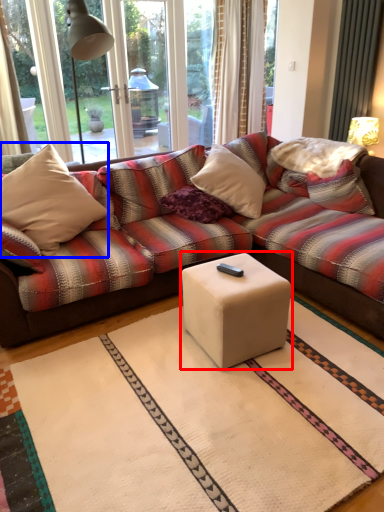
Question: Which of the following is the farthest to the observer, coffee table (highlighted by a red box) or throw pillow (highlighted by a blue box)?

Choices:
 (A) coffee table
 (B) throw pillow

Answer: (B)